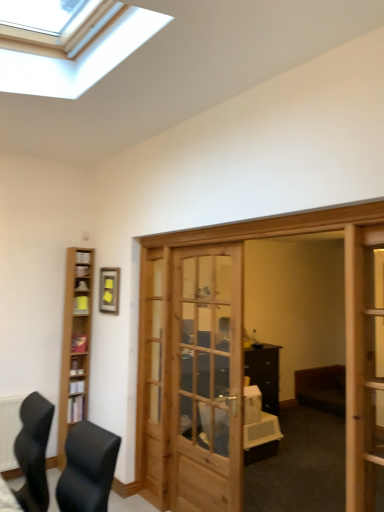
Question: Is yellow paper at left, placed as the first shelf when sorted from top to bottom, to the left of black leather chair at lower left from the viewer's perspective?

Choices:
 (A) yes
 (B) no

Answer: (A)

Question: Is yellow paper at left, placed as the first shelf when sorted from top to bottom, bigger than black leather chair at lower left?

Choices:
 (A) yes
 (B) no

Answer: (B)

Question: Is yellow paper at left, which is counted as the 1th shelf, starting from the back, oriented away from black leather chair at lower left?

Choices:
 (A) yes
 (B) no

Answer: (B)

Question: Would you say black leather chair at lower left is part of yellow paper at left, which ranks as the 2th shelf in bottom-to-top order,'s contents?

Choices:
 (A) yes
 (B) no

Answer: (B)

Question: Considering the relative positions of yellow paper at left, which ranks as the 2th shelf in bottom-to-top order, and black leather chair at lower left in the image provided, is yellow paper at left, which ranks as the 2th shelf in bottom-to-top order, behind black leather chair at lower left?

Choices:
 (A) yes
 (B) no

Answer: (A)

Question: From a real-world perspective, is yellow paper at left, which is counted as the 1th shelf, starting from the back, located beneath black leather chair at lower left?

Choices:
 (A) yes
 (B) no

Answer: (B)

Question: Is wooden screen door at right a part of yellow paper at left, which is counted as the 1th shelf, starting from the back?

Choices:
 (A) no
 (B) yes

Answer: (A)

Question: Does yellow paper at left, placed as the first shelf when sorted from top to bottom, appear on the right side of wooden screen door at right?

Choices:
 (A) yes
 (B) no

Answer: (B)

Question: From a real-world perspective, is yellow paper at left, which ranks as the 2th shelf in bottom-to-top order, positioned over wooden screen door at right based on gravity?

Choices:
 (A) yes
 (B) no

Answer: (A)

Question: Is yellow paper at left, the 2th shelf positioned from the front, oriented away from wooden screen door at right?

Choices:
 (A) no
 (B) yes

Answer: (A)

Question: Considering the relative sizes of yellow paper at left, which is counted as the 1th shelf, starting from the back, and wooden screen door at right in the image provided, is yellow paper at left, which is counted as the 1th shelf, starting from the back, smaller than wooden screen door at right?

Choices:
 (A) no
 (B) yes

Answer: (B)

Question: Does yellow paper at left, which is counted as the 1th shelf, starting from the back, lie behind wooden screen door at right?

Choices:
 (A) yes
 (B) no

Answer: (A)

Question: Is yellow paper at left, the 2th shelf positioned from the front, oriented away from light brown wood bookshelf at left?

Choices:
 (A) yes
 (B) no

Answer: (A)